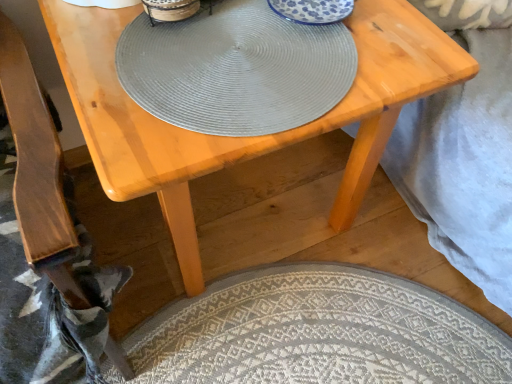
At what (x,y) coordinates should I click in order to perform the action: click on free spot above matte gray placemat at center (from a real-world perspective). Please return your answer as a coordinate pair (x, y). This screenshot has height=384, width=512. Looking at the image, I should click on (239, 55).